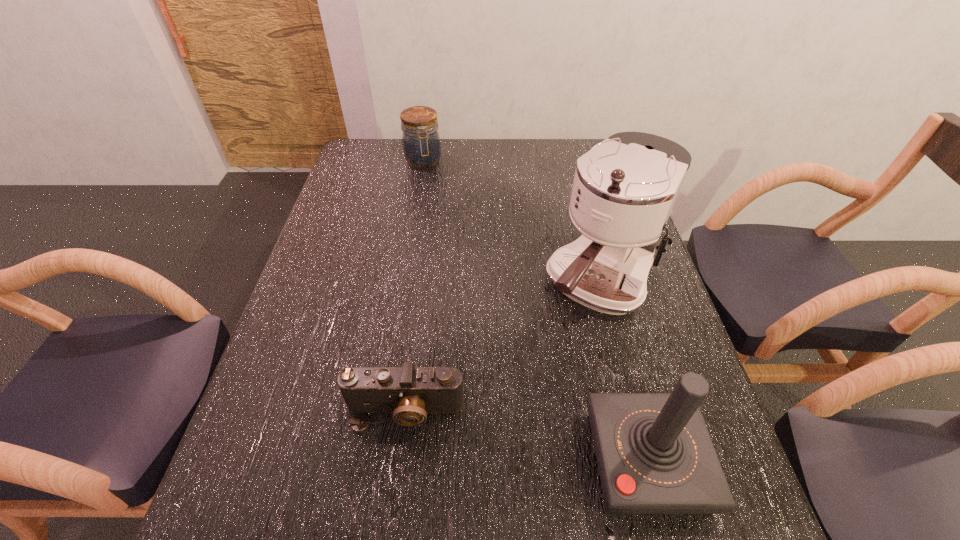
At what (x,y) coordinates should I click in order to perform the action: click on vacant space located 0.360m on the front-facing side of the second farthest object. Please return your answer as a coordinate pair (x, y). The height and width of the screenshot is (540, 960). Looking at the image, I should click on (482, 453).

The height and width of the screenshot is (540, 960). Find the location of `blank area located on the front-facing side of the second farthest object`. blank area located on the front-facing side of the second farthest object is located at coordinates 527,392.

The width and height of the screenshot is (960, 540). I want to click on blank area located on the front-facing side of the second farthest object, so click(x=560, y=347).

Locate an element on the screen. Image resolution: width=960 pixels, height=540 pixels. object at the far edge is located at coordinates (421, 143).

Locate an element on the screen. Image resolution: width=960 pixels, height=540 pixels. object present at the near edge is located at coordinates (654, 453).

This screenshot has height=540, width=960. I want to click on joystick at the right edge, so coord(654,453).

At what (x,y) coordinates should I click in order to perform the action: click on coffee maker located at the right edge. Please return your answer as a coordinate pair (x, y). The width and height of the screenshot is (960, 540). Looking at the image, I should click on (624, 189).

Identify the location of object located at the near right corner. The height and width of the screenshot is (540, 960). (654, 453).

Identify the location of vacant area at the far edge. (x=544, y=161).

Image resolution: width=960 pixels, height=540 pixels. What are the coordinates of `free space at the left edge` in the screenshot? It's located at (355, 188).